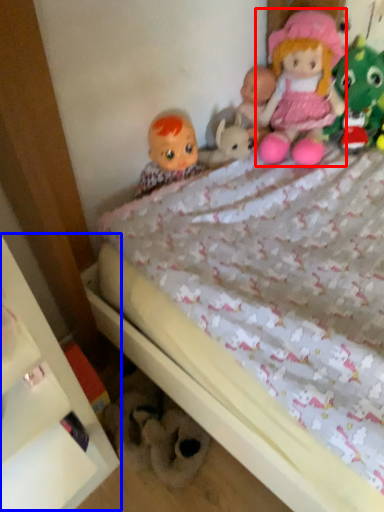
Question: Which of the following is the farthest to the observer, doll (highlighted by a red box) or shelf (highlighted by a blue box)?

Choices:
 (A) doll
 (B) shelf

Answer: (A)